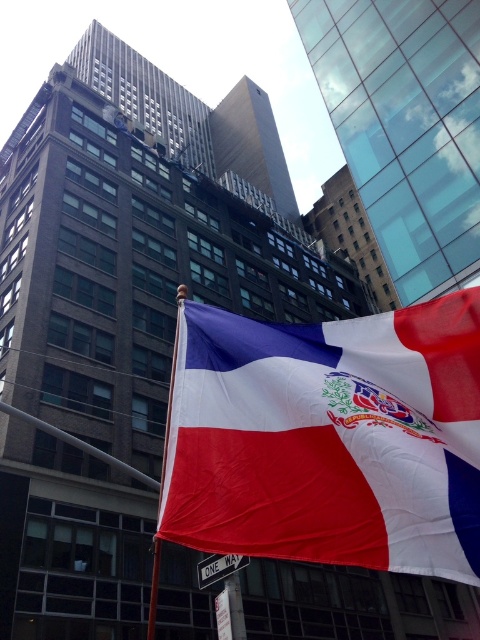
You are standing in the urban scene described. If you want to touch the textured fabric flag at center, which direction should you move relative to your current position?

Since the textured fabric flag at center is located at coordinates approximately 0.686 on the x and y axis, you should move towards the center of the image to reach it.

Looking at this image, you are standing in front of the flag and want to take a photo that includes both the textured fabric flag at center and the metallic flag pole at center. Based on their positions, which one should you place on the left side of your photo to include both in the frame?

You should place the metallic flag pole at center on the left side of your photo because the textured fabric flag at center is to the right of it, ensuring both are included in the frame.

You are a photographer standing in front of the textured fabric flag at center and the metallic flag pole at center. You want to take a picture that focuses on the flag while keeping the pole in the background. Is the current arrangement suitable for this purpose?

Yes, the current arrangement is suitable because the textured fabric flag at center is closer to the viewer than the metallic flag pole at center, allowing the flag to be in focus while the pole appears in the background.